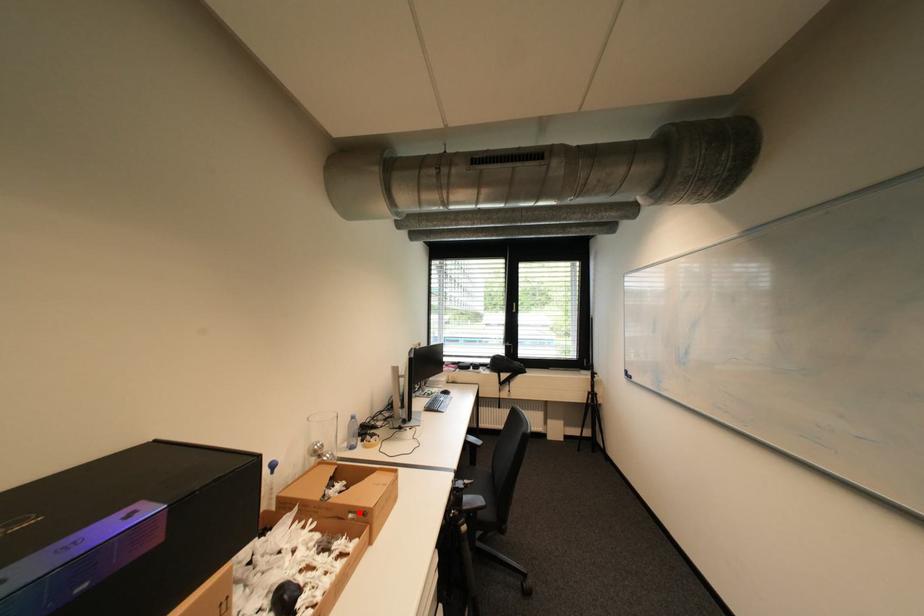
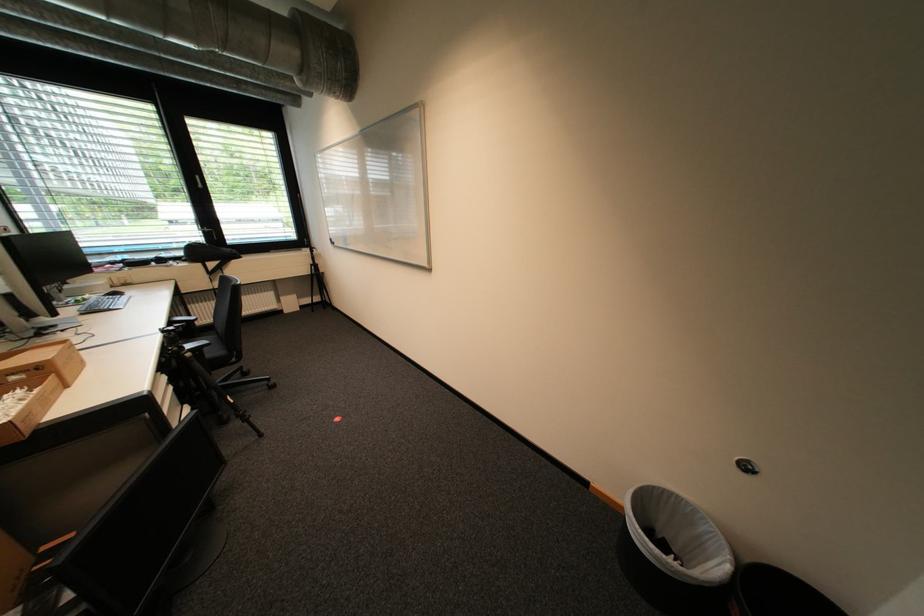
Question: A red point is marked in image1. In image2, is the corresponding 3D point closer to the camera or farther? Reply with the corresponding letter.

Choices:
 (A) The corresponding 3D point is closer.
 (B) The corresponding 3D point is farther.

Answer: (B)